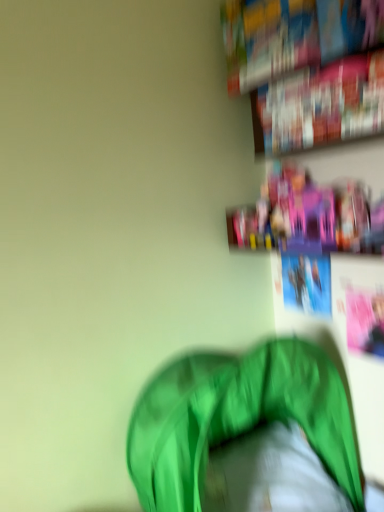
Question: Could pink plastic toys at upper right be considered to be inside hardcover book at upper right, marked as the 2th book in a top-to-bottom arrangement?

Choices:
 (A) no
 (B) yes

Answer: (A)

Question: Considering the relative sizes of hardcover book at upper right, the 1th book positioned from the bottom, and pink plastic toys at upper right in the image provided, is hardcover book at upper right, the 1th book positioned from the bottom, bigger than pink plastic toys at upper right?

Choices:
 (A) no
 (B) yes

Answer: (A)

Question: Is hardcover book at upper right, marked as the 2th book in a top-to-bottom arrangement, facing away from pink plastic toys at upper right?

Choices:
 (A) no
 (B) yes

Answer: (A)

Question: Considering the relative positions of hardcover book at upper right, the 1th book positioned from the bottom, and pink plastic toys at upper right in the image provided, is hardcover book at upper right, the 1th book positioned from the bottom, to the left of pink plastic toys at upper right from the viewer's perspective?

Choices:
 (A) no
 (B) yes

Answer: (A)

Question: Is hardcover book at upper right, marked as the 2th book in a top-to-bottom arrangement, placed right next to pink plastic toys at upper right?

Choices:
 (A) yes
 (B) no

Answer: (B)

Question: Is hardcover book at upper right, the 1th book positioned from the bottom, wider or thinner than pink plastic toys at upper right?

Choices:
 (A) wide
 (B) thin

Answer: (B)

Question: Considering the positions of hardcover book at upper right, the 1th book positioned from the bottom, and pink plastic toys at upper right in the image, is hardcover book at upper right, the 1th book positioned from the bottom, taller or shorter than pink plastic toys at upper right?

Choices:
 (A) tall
 (B) short

Answer: (A)

Question: From the image's perspective, is hardcover book at upper right, the 1th book positioned from the bottom, located above or below pink plastic toys at upper right?

Choices:
 (A) above
 (B) below

Answer: (A)

Question: From a real-world perspective, is hardcover book at upper right, the 1th book positioned from the bottom, above or below pink plastic toys at upper right?

Choices:
 (A) above
 (B) below

Answer: (A)

Question: Is green fabric bean bag at lower center to the left or to the right of hardcover book at upper right, the 1th book positioned from the bottom, in the image?

Choices:
 (A) left
 (B) right

Answer: (A)

Question: Do you think green fabric bean bag at lower center is within hardcover book at upper right, the 1th book positioned from the bottom, or outside of it?

Choices:
 (A) inside
 (B) outside

Answer: (B)

Question: In the image, is green fabric bean bag at lower center positioned in front of or behind hardcover book at upper right, marked as the 2th book in a top-to-bottom arrangement?

Choices:
 (A) behind
 (B) front

Answer: (B)

Question: Is point (233, 418) closer or farther from the camera than point (283, 126)?

Choices:
 (A) closer
 (B) farther

Answer: (A)

Question: Considering the positions of hardcover book at upper right, marked as the 2th book in a top-to-bottom arrangement, and hardcover book at upper right, placed as the 1th book when sorted from top to bottom, in the image, is hardcover book at upper right, marked as the 2th book in a top-to-bottom arrangement, bigger or smaller than hardcover book at upper right, placed as the 1th book when sorted from top to bottom,?

Choices:
 (A) small
 (B) big

Answer: (B)

Question: From the image's perspective, relative to hardcover book at upper right, which is the 2th book in bottom-to-top order, is hardcover book at upper right, marked as the 2th book in a top-to-bottom arrangement, above or below?

Choices:
 (A) above
 (B) below

Answer: (B)